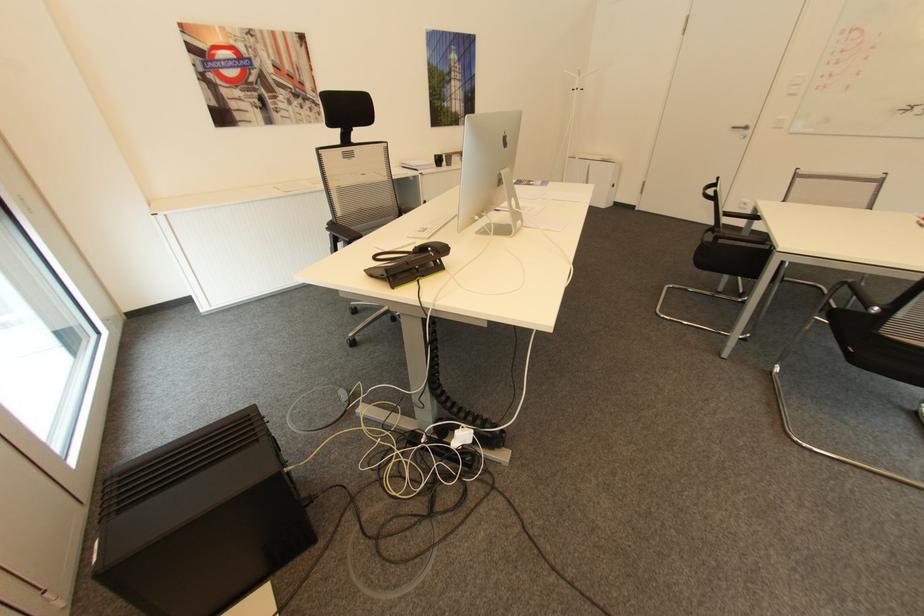
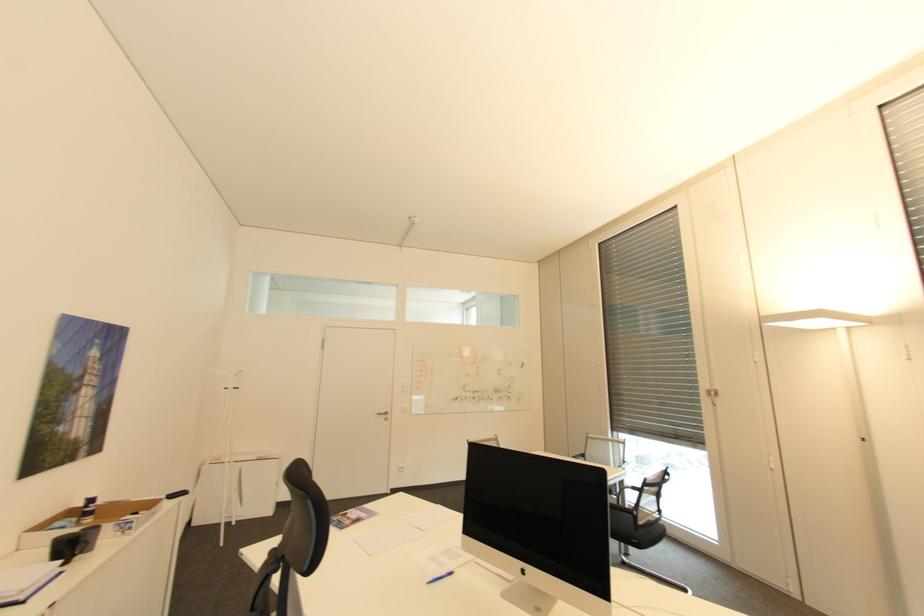
In the second image, find the point that corresponds to point 749,128 in the first image.

(391, 413)